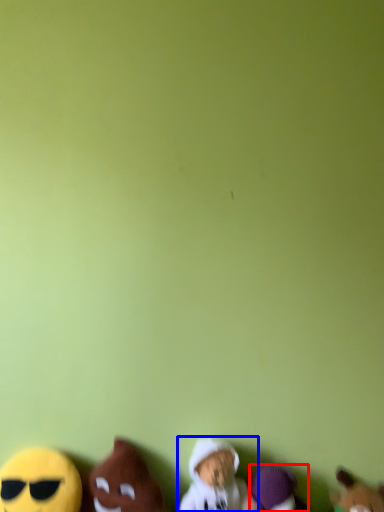
Question: Which of the following is the farthest to the observer, toy (highlighted by a red box) or toy (highlighted by a blue box)?

Choices:
 (A) toy
 (B) toy

Answer: (A)